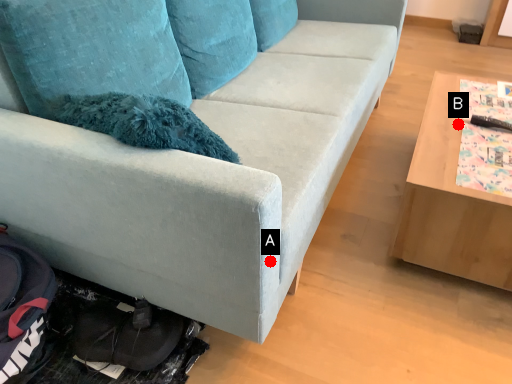
Question: Two points are circled on the image, labeled by A and B beside each circle. Which point is closer to the camera?

Choices:
 (A) A is closer
 (B) B is closer

Answer: (A)